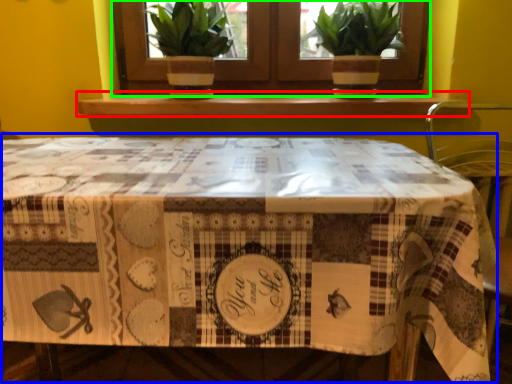
Question: Based on their relative distances, which object is nearer to window sill (highlighted by a red box)? Choose from table (highlighted by a blue box) and window (highlighted by a green box).

Choices:
 (A) table
 (B) window

Answer: (B)